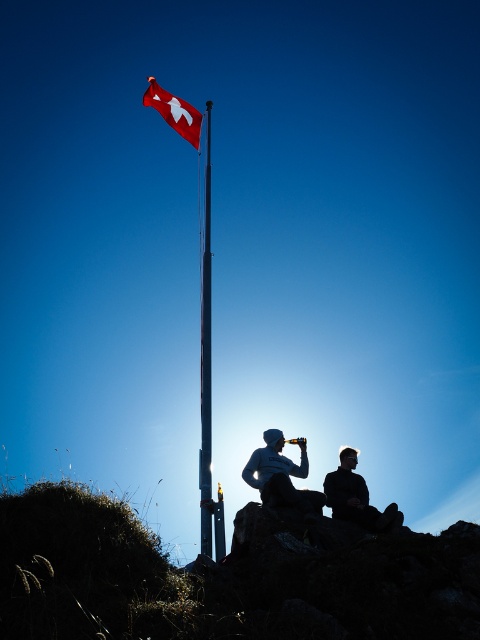
You are a photographer trying to capture a closeup of the Swiss flag. You notice two objects at the center of your viewfinder, the silhouette clothing at center and the matte black beanie at center. Which object should you adjust your focus to avoid blurring, considering their sizes?

The silhouette clothing at center is wider than the matte black beanie at center, so focusing on the silhouette clothing at center would ensure the larger object remains sharp while the smaller beanie may blur slightly, depending on depth of field.

You are a photographer trying to capture a clear shot of the silhouette clothing at center and the polished metal flag pole at upper center. However, you notice that one object is blocking the view of the other. Which object is obstructing the view of the other?

The silhouette clothing at center is in front of the polished metal flag pole at upper center, so it is blocking the view of the flag pole.